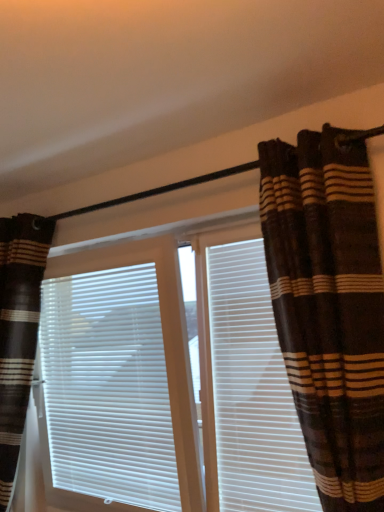
Question: Is brown striped curtain at left, which ranks as the 1th curtain in back-to-front order, not close to brown striped curtain at right, the 1th curtain viewed from the right?

Choices:
 (A) no
 (B) yes

Answer: (B)

Question: Can we say brown striped curtain at left, arranged as the 2th curtain when viewed from the front, lies outside brown striped curtain at right, the 1th curtain positioned from the front?

Choices:
 (A) yes
 (B) no

Answer: (A)

Question: From the image's perspective, is brown striped curtain at left, arranged as the 2th curtain when viewed from the front, located above brown striped curtain at right, which is the second curtain from left to right?

Choices:
 (A) yes
 (B) no

Answer: (B)

Question: From a real-world perspective, does brown striped curtain at left, arranged as the 2th curtain when viewed from the front, stand above brown striped curtain at right, the 1th curtain viewed from the right?

Choices:
 (A) yes
 (B) no

Answer: (B)

Question: Does brown striped curtain at left, marked as the second curtain in a right-to-left arrangement, have a greater height compared to brown striped curtain at right, placed as the 2th curtain when sorted from back to front?

Choices:
 (A) no
 (B) yes

Answer: (B)

Question: Is brown striped curtain at left, which is counted as the first curtain, starting from the left, smaller than brown striped curtain at right, which is the second curtain from left to right?

Choices:
 (A) no
 (B) yes

Answer: (A)

Question: From the image's perspective, would you say white matte window blind at center is shown under white plastic shutter at center?

Choices:
 (A) no
 (B) yes

Answer: (B)

Question: Does white matte window blind at center have a lesser width compared to white plastic shutter at center?

Choices:
 (A) no
 (B) yes

Answer: (A)

Question: Does white matte window blind at center appear on the right side of white plastic shutter at center?

Choices:
 (A) no
 (B) yes

Answer: (A)

Question: Is white matte window blind at center to the left of white plastic shutter at center from the viewer's perspective?

Choices:
 (A) yes
 (B) no

Answer: (A)

Question: Is white matte window blind at center further to camera compared to white plastic shutter at center?

Choices:
 (A) no
 (B) yes

Answer: (B)

Question: Can you confirm if white matte window blind at center is shorter than white plastic shutter at center?

Choices:
 (A) no
 (B) yes

Answer: (B)

Question: Would you say brown striped curtains at center is outside white matte window blind at center?

Choices:
 (A) no
 (B) yes

Answer: (B)